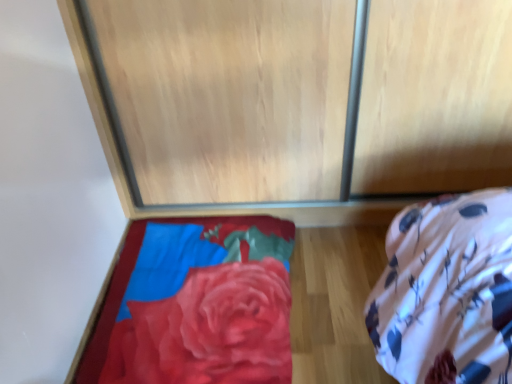
Locate an element on the screen. Image resolution: width=512 pixels, height=384 pixels. silky fabric rose at lower center is located at coordinates (209, 330).

Describe the element at coordinates (209, 330) in the screenshot. I see `silky fabric rose at lower center` at that location.

The height and width of the screenshot is (384, 512). I want to click on silky fabric rose at lower center, so click(x=209, y=330).